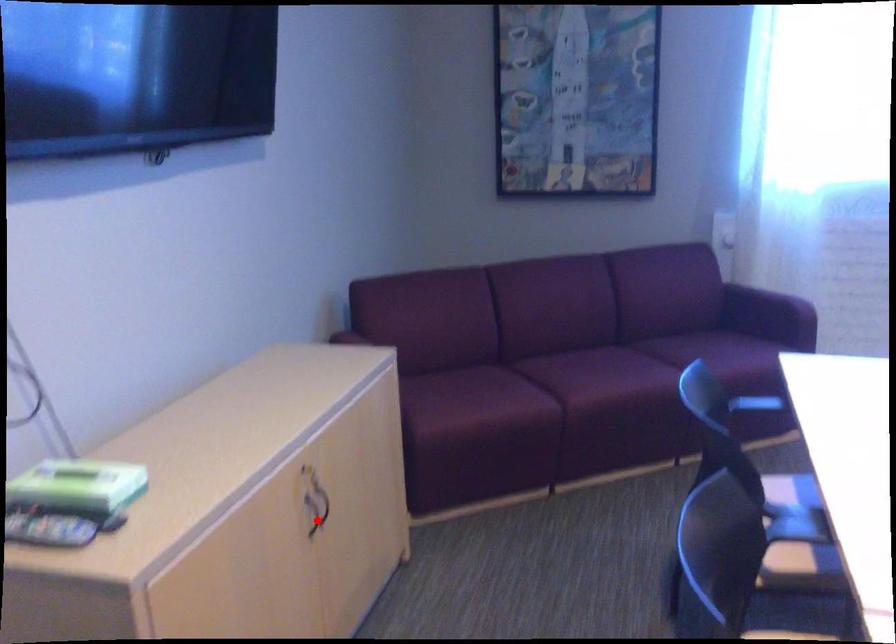
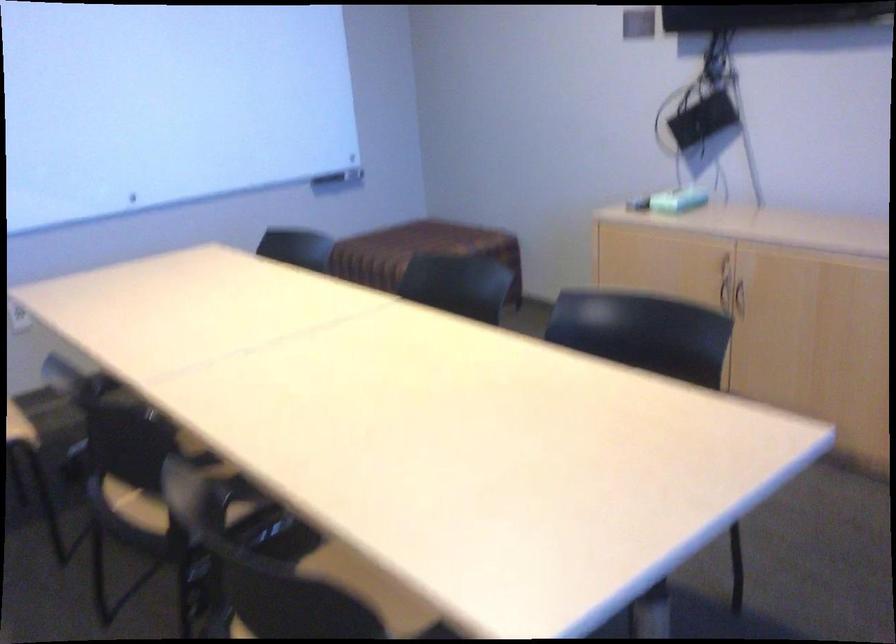
In the second image, find the point that corresponds to the highlighted location in the first image.

(738, 299)